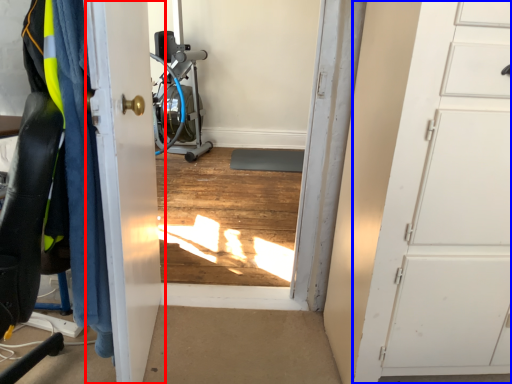
Question: Which of the following is the farthest to the observer, door (highlighted by a red box) or door (highlighted by a blue box)?

Choices:
 (A) door
 (B) door

Answer: (B)